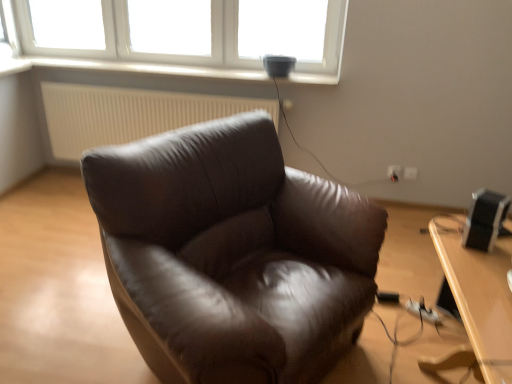
Question: Does light brown wooden table at lower right turn towards black plastic speaker at right?

Choices:
 (A) yes
 (B) no

Answer: (B)

Question: From a real-world perspective, is light brown wooden table at lower right beneath black plastic speaker at right?

Choices:
 (A) yes
 (B) no

Answer: (A)

Question: Is light brown wooden table at lower right not inside black plastic speaker at right?

Choices:
 (A) no
 (B) yes

Answer: (B)

Question: Can you confirm if light brown wooden table at lower right is taller than black plastic speaker at right?

Choices:
 (A) no
 (B) yes

Answer: (B)

Question: From a real-world perspective, is light brown wooden table at lower right physically above black plastic speaker at right?

Choices:
 (A) no
 (B) yes

Answer: (A)

Question: Would you say white textured radiator at upper center is inside or outside white plastic electric outlet at lower right, acting as the second electric outlet starting from the left?

Choices:
 (A) outside
 (B) inside

Answer: (A)

Question: Is white textured radiator at upper center taller or shorter than white plastic electric outlet at lower right, arranged as the 1th electric outlet when viewed from the right?

Choices:
 (A) short
 (B) tall

Answer: (B)

Question: In terms of width, does white textured radiator at upper center look wider or thinner when compared to white plastic electric outlet at lower right, acting as the second electric outlet starting from the left?

Choices:
 (A) thin
 (B) wide

Answer: (B)

Question: Considering their positions, is white textured radiator at upper center located in front of or behind white plastic electric outlet at lower right, acting as the second electric outlet starting from the left?

Choices:
 (A) front
 (B) behind

Answer: (A)

Question: Is point (498, 264) positioned closer to the camera than point (399, 173)?

Choices:
 (A) closer
 (B) farther

Answer: (A)

Question: From a real-world perspective, is light brown wooden table at lower right above or below white plastic electric outlet at center-right, the first electric outlet from the left?

Choices:
 (A) above
 (B) below

Answer: (A)

Question: Looking at their shapes, would you say light brown wooden table at lower right is wider or thinner than white plastic electric outlet at center-right, which is the 2th electric outlet in right-to-left order?

Choices:
 (A) wide
 (B) thin

Answer: (A)

Question: In terms of height, does light brown wooden table at lower right look taller or shorter compared to white plastic electric outlet at center-right, which is the 2th electric outlet in right-to-left order?

Choices:
 (A) short
 (B) tall

Answer: (B)

Question: Based on their sizes in the image, would you say black plastic speaker at right is bigger or smaller than light brown wooden table at lower right?

Choices:
 (A) small
 (B) big

Answer: (A)

Question: Do you think black plastic speaker at right is within light brown wooden table at lower right, or outside of it?

Choices:
 (A) outside
 (B) inside

Answer: (A)